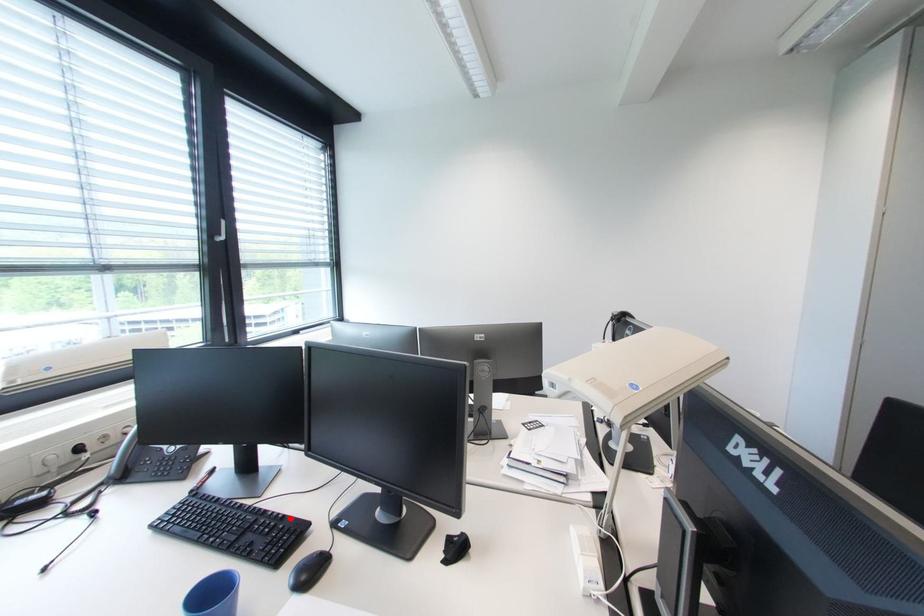
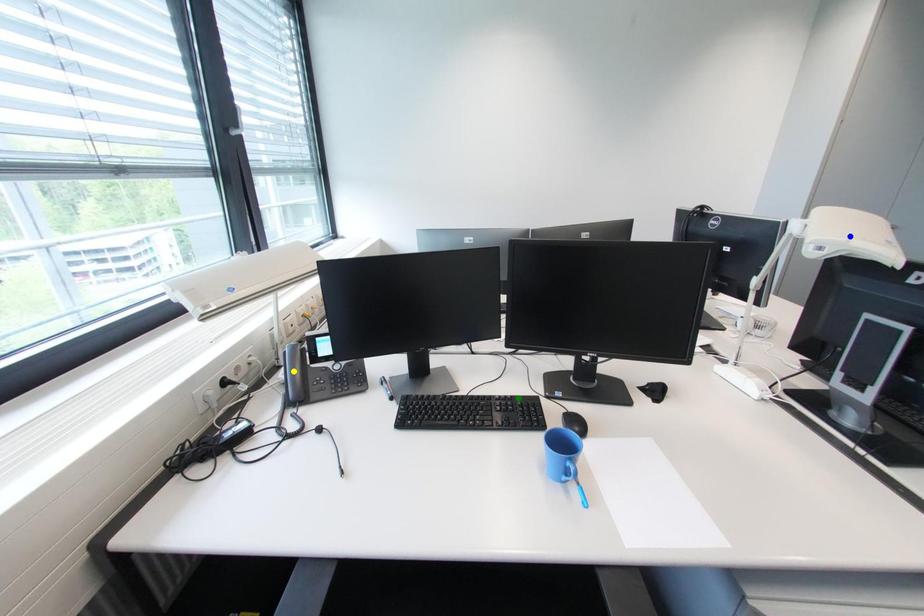
Question: I am providing you with two images of the same scene from different viewpoints. A red point is marked on the first image. You are given multiple points on the second image. Which spot in image 2 lines up with the point in image 1?

Choices:
 (A) blue point
 (B) yellow point
 (C) green point

Answer: (C)